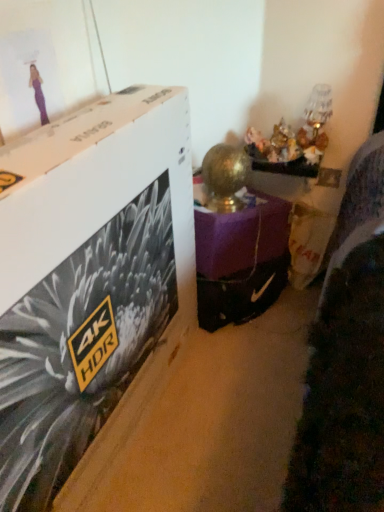
This screenshot has height=512, width=384. Describe the element at coordinates (241, 259) in the screenshot. I see `purple matte lamp at center` at that location.

Measure the distance between point (243, 307) and camera.

Point (243, 307) is 1.74 meters away from camera.

Where is `purple matte lamp at center`? This screenshot has width=384, height=512. purple matte lamp at center is located at coordinates (241, 259).

Measure the distance between point (x=8, y=362) and camera.

Point (x=8, y=362) is 28.74 inches from camera.

This screenshot has width=384, height=512. Describe the element at coordinates (87, 275) in the screenshot. I see `white cardboard box at upper left` at that location.

In order to face white cardboard box at upper left, should I rotate leftwards or rightwards?

A 12.799 degree turn to the left will do.

I want to click on white cardboard box at upper left, so click(87, 275).

Find the location of a particular element. The image size is (384, 512). purple matte lamp at center is located at coordinates (241, 259).

Would you say white cardboard box at upper left is to the left or to the right of purple matte lamp at center in the picture?

Clearly, white cardboard box at upper left is on the left of purple matte lamp at center in the image.

Considering their positions, is white cardboard box at upper left located in front of or behind purple matte lamp at center?

Clearly, white cardboard box at upper left is in front of purple matte lamp at center.

Considering the points (180, 141) and (197, 187), which point is in front, point (180, 141) or point (197, 187)?

The point (180, 141) is closer.

From the image's perspective, is white cardboard box at upper left above purple matte lamp at center?

No, from the image's perspective, white cardboard box at upper left is not on top of purple matte lamp at center.

From a real-world perspective, does white cardboard box at upper left sit lower than purple matte lamp at center?

Actually, white cardboard box at upper left is physically above purple matte lamp at center in the real world.

Can you confirm if white cardboard box at upper left is wider than purple matte lamp at center?

In fact, white cardboard box at upper left might be narrower than purple matte lamp at center.

From their relative heights in the image, would you say white cardboard box at upper left is taller or shorter than purple matte lamp at center?

Considering their sizes, white cardboard box at upper left has more height than purple matte lamp at center.

Which of these two, white cardboard box at upper left or purple matte lamp at center, is smaller?

Smaller between the two is purple matte lamp at center.

Does white cardboard box at upper left contain purple matte lamp at center?

No, purple matte lamp at center is not surrounded by white cardboard box at upper left.

Is white cardboard box at upper left not close to purple matte lamp at center?

No, there isn't a large distance between white cardboard box at upper left and purple matte lamp at center.

Could you tell me if white cardboard box at upper left is turned towards purple matte lamp at center?

No.

How different are the orientations of white cardboard box at upper left and purple matte lamp at center in degrees?

The angular difference between white cardboard box at upper left and purple matte lamp at center is 35.3 degrees.

Where is `furniture on the right of white cardboard box at upper left`? Image resolution: width=384 pixels, height=512 pixels. furniture on the right of white cardboard box at upper left is located at coordinates (241, 259).

Which is more to the right, purple matte lamp at center or white cardboard box at upper left?

Positioned to the right is purple matte lamp at center.

Does purple matte lamp at center come in front of white cardboard box at upper left?

No, it is not.

Is point (259, 238) closer or farther from the camera than point (92, 384)?

Clearly, point (259, 238) is more distant from the camera than point (92, 384).

In the scene shown: From the image's perspective, is purple matte lamp at center on top of white cardboard box at upper left?

Correct, purple matte lamp at center appears higher than white cardboard box at upper left in the image.

From a real-world perspective, which object rests below the other?

purple matte lamp at center, from a real-world perspective.

Between purple matte lamp at center and white cardboard box at upper left, which one has larger width?

Wider between the two is purple matte lamp at center.

Considering the sizes of purple matte lamp at center and white cardboard box at upper left in the image, is purple matte lamp at center taller or shorter than white cardboard box at upper left?

In the image, purple matte lamp at center appears to be shorter than white cardboard box at upper left.

Considering the relative sizes of purple matte lamp at center and white cardboard box at upper left in the image provided, is purple matte lamp at center bigger than white cardboard box at upper left?

Incorrect, purple matte lamp at center is not larger than white cardboard box at upper left.

Is purple matte lamp at center located outside white cardboard box at upper left?

Yes, purple matte lamp at center is outside of white cardboard box at upper left.

Are purple matte lamp at center and white cardboard box at upper left beside each other?

No, purple matte lamp at center is not beside white cardboard box at upper left.

Is purple matte lamp at center looking in the opposite direction of white cardboard box at upper left?

purple matte lamp at center does not have its back to white cardboard box at upper left.

From the picture: What's the angular difference between purple matte lamp at center and white cardboard box at upper left's facing directions?

The angular difference between purple matte lamp at center and white cardboard box at upper left is 35.3 degrees.

Measure the distance from purple matte lamp at center to white cardboard box at upper left.

The distance of purple matte lamp at center from white cardboard box at upper left is 58.35 centimeters.

This screenshot has width=384, height=512. Identify the location of box below the purple matte lamp at center (from the image's perspective). (87, 275).

Where is `box that appears on the left of purple matte lamp at center`? The height and width of the screenshot is (512, 384). box that appears on the left of purple matte lamp at center is located at coordinates (87, 275).

Where is `box below the purple matte lamp at center (from the image's perspective)`? Image resolution: width=384 pixels, height=512 pixels. box below the purple matte lamp at center (from the image's perspective) is located at coordinates (87, 275).